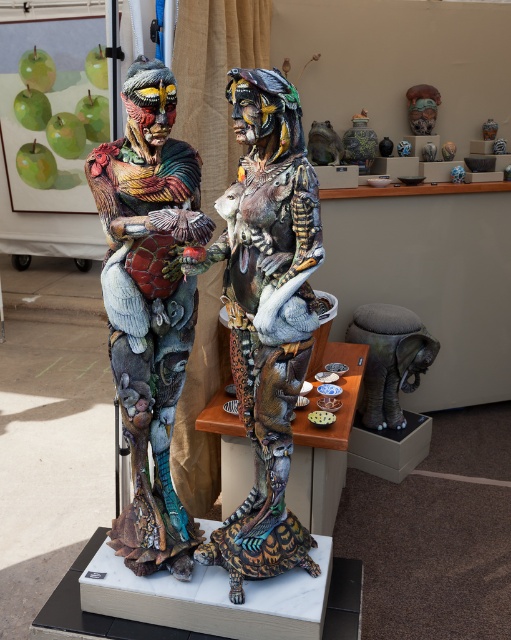
You are standing in front of two sculptures on a white pedestal. You notice two points marked on the sculptures. The first point is at coordinates point (165, 499) and the second point is at point (404, 380). Which of these points is closer to you?

Point (165, 499) is closer to the viewer than point (404, 380).

You are an art curator planning to move the brown leather stool at lower right closer to the multicolored painted sculpture at center. Based on their current positions, will the stool be placed underneath the sculpture after moving it?

The multicolored painted sculpture at center is currently above the brown leather stool at lower right. If you move the stool closer to the sculpture, it will be placed underneath it since the sculpture is positioned higher up.